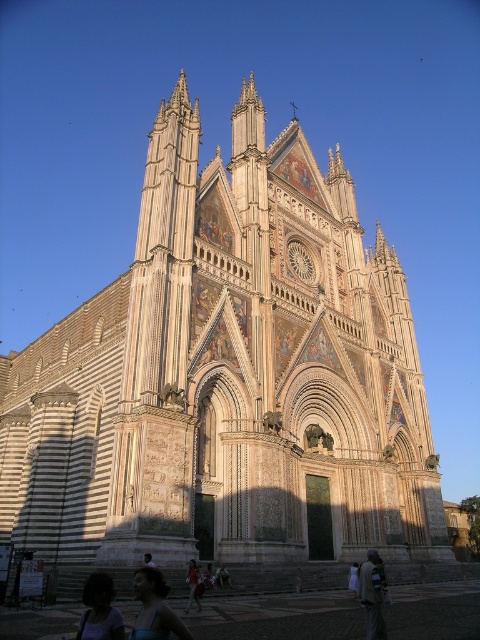
Can you confirm if blue fabric person at lower left is thinner than light brown leather jacket at lower center?

No.

Between point (159, 608) and point (195, 600), which one is positioned in front?

Point (159, 608) is more forward.

Between point (143, 621) and point (191, 566), which one is positioned in front?

Point (143, 621) is more forward.

The image size is (480, 640). In order to click on blue fabric person at lower left in this screenshot , I will do `click(155, 609)`.

Which of these two, light brown leather jacket at lower center or light brown hair at lower center, stands shorter?

With less height is light brown hair at lower center.

Does light brown leather jacket at lower center appear on the left side of light brown hair at lower center?

No, light brown leather jacket at lower center is not to the left of light brown hair at lower center.

Which is behind, point (191, 600) or point (149, 564)?

Point (191, 600)

This screenshot has height=640, width=480. What are the coordinates of `light brown leather jacket at lower center` in the screenshot? It's located at (192, 586).

Is matte black hair at lower center thinner than light brown hair at lower center?

No, matte black hair at lower center is not thinner than light brown hair at lower center.

Based on the photo, does matte black hair at lower center have a lesser height compared to light brown hair at lower center?

In fact, matte black hair at lower center may be taller than light brown hair at lower center.

You are a GUI agent. You are given a task and a screenshot of the screen. Output one action in this format:
    pyautogui.click(x=<x>, y=<y>)
    Task: Click on the matte black hair at lower center
    Image resolution: width=480 pixels, height=640 pixels.
    Given the screenshot: What is the action you would take?
    pyautogui.click(x=99, y=611)

Identify the location of matte black hair at lower center. click(99, 611).